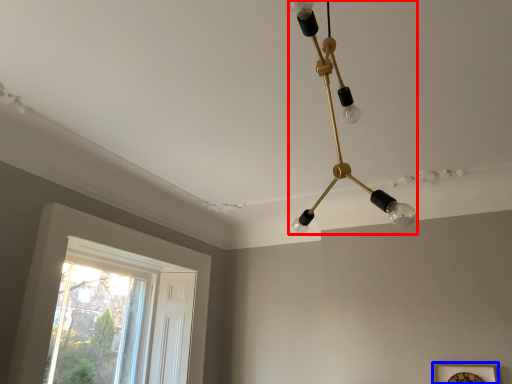
Question: Among these objects, which one is nearest to the camera, lamp (highlighted by a red box) or picture frame (highlighted by a blue box)?

Choices:
 (A) lamp
 (B) picture frame

Answer: (A)